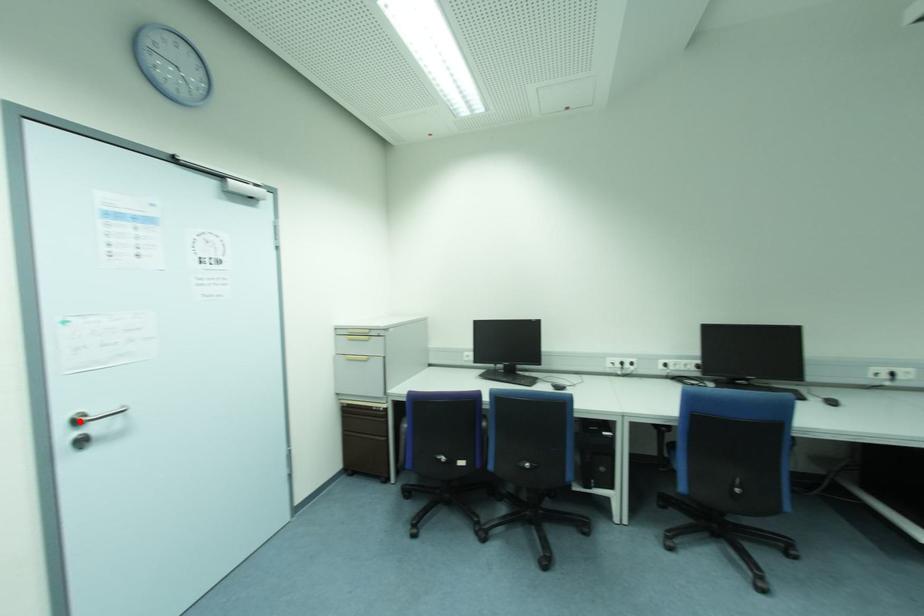
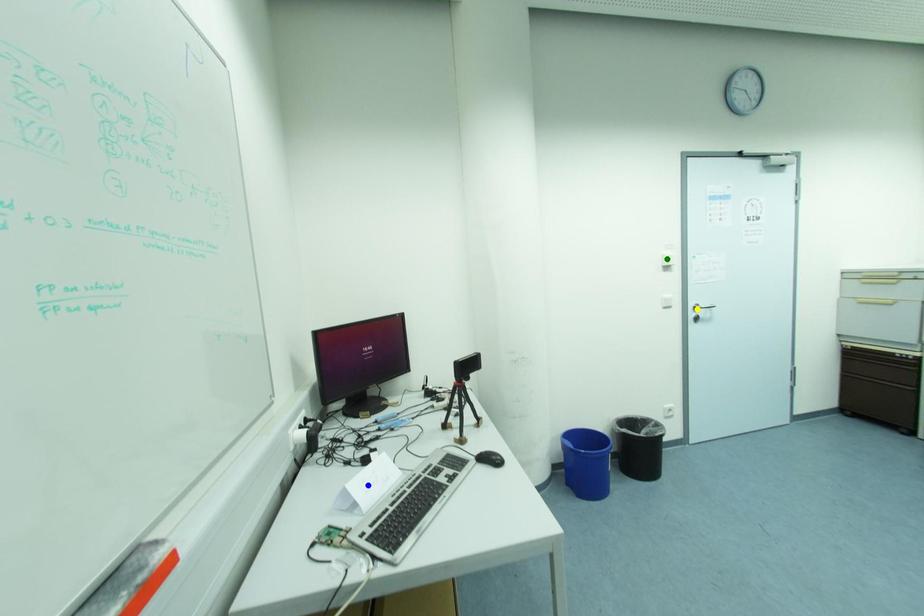
Question: I am providing you with two images of the same scene from different viewpoints. A red point is marked on the first image. You are given multiple points on the second image. Which mark in image 2 goes with the point in image 1?

Choices:
 (A) green point
 (B) yellow point
 (C) blue point

Answer: (B)